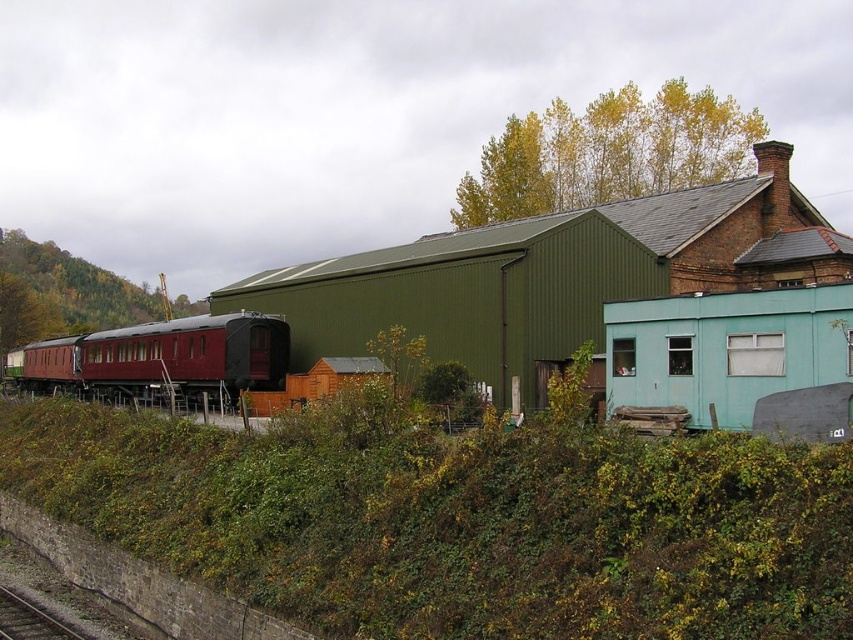
Between green corrugated metal shed at center and maroon polished wood train car at left, which one has less height?

maroon polished wood train car at left

Can you confirm if green corrugated metal shed at center is positioned below maroon polished wood train car at left?

Incorrect, green corrugated metal shed at center is not positioned below maroon polished wood train car at left.

Image resolution: width=853 pixels, height=640 pixels. What do you see at coordinates (552, 276) in the screenshot? I see `green corrugated metal shed at center` at bounding box center [552, 276].

At what (x,y) coordinates should I click in order to perform the action: click on green corrugated metal shed at center. Please return your answer as a coordinate pair (x, y). This screenshot has width=853, height=640. Looking at the image, I should click on (552, 276).

Who is more forward, (x=712, y=253) or (x=12, y=621)?

Point (x=12, y=621) is more forward.

The width and height of the screenshot is (853, 640). Identify the location of green corrugated metal shed at center. (552, 276).

Between point (451, 314) and point (3, 593), which one is positioned behind?

Point (451, 314)

The height and width of the screenshot is (640, 853). Identify the location of green corrugated metal shed at center. (552, 276).

Which is in front, point (527, 538) or point (776, 250)?

Point (527, 538) is more forward.

This screenshot has width=853, height=640. I want to click on green leafy vegetation at lower center, so click(x=460, y=520).